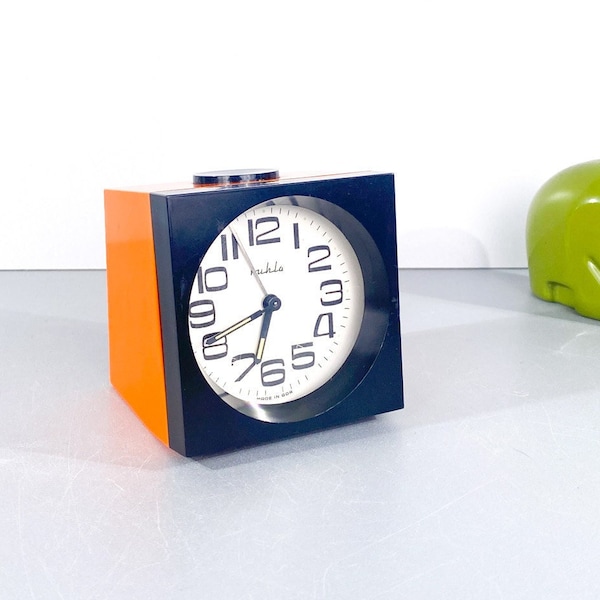
Where is `button on clock`? Image resolution: width=600 pixels, height=600 pixels. button on clock is located at coordinates (248, 175).